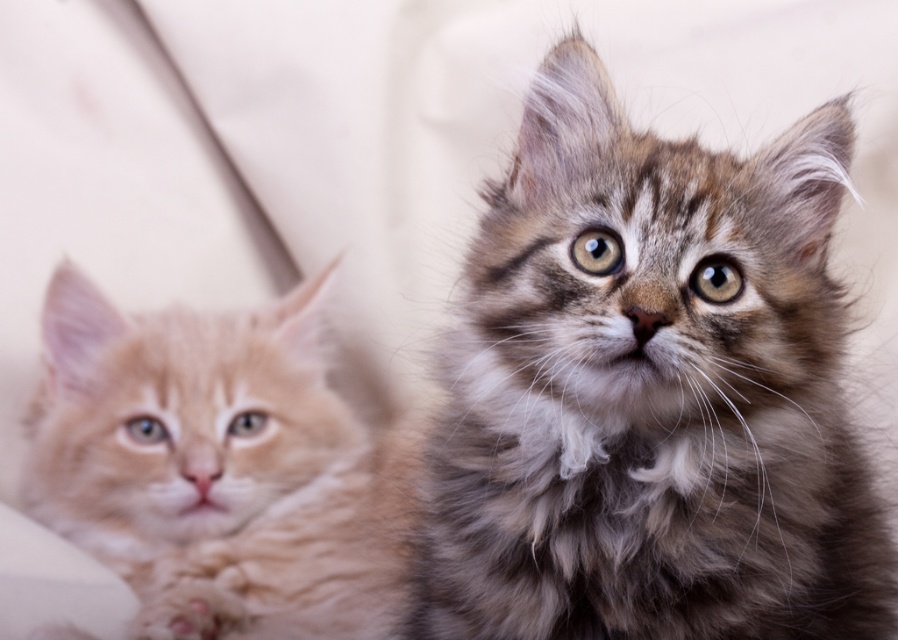
From the picture: Is fuzzy gray tabby kitten at center bigger than orange tabby kitten at left?

Incorrect, fuzzy gray tabby kitten at center is not larger than orange tabby kitten at left.

Does fuzzy gray tabby kitten at center appear on the left side of orange tabby kitten at left?

Incorrect, fuzzy gray tabby kitten at center is not on the left side of orange tabby kitten at left.

Is point (637, 438) behind point (288, 550)?

No, (637, 438) is closer to viewer.

You are a GUI agent. You are given a task and a screenshot of the screen. Output one action in this format:
    pyautogui.click(x=<x>, y=<y>)
    Task: Click on the fuzzy gray tabby kitten at center
    The width and height of the screenshot is (898, 640).
    Given the screenshot: What is the action you would take?
    pyautogui.click(x=649, y=394)